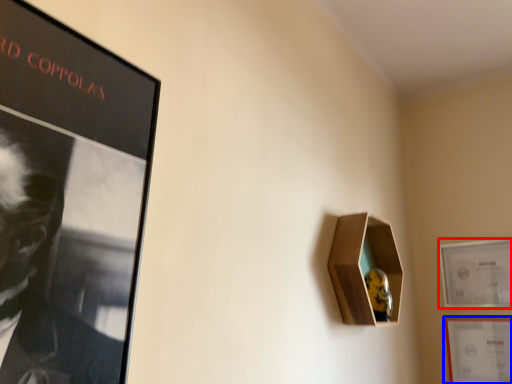
Question: Which object is closer to the camera taking this photo, picture frame (highlighted by a red box) or picture frame (highlighted by a blue box)?

Choices:
 (A) picture frame
 (B) picture frame

Answer: (B)